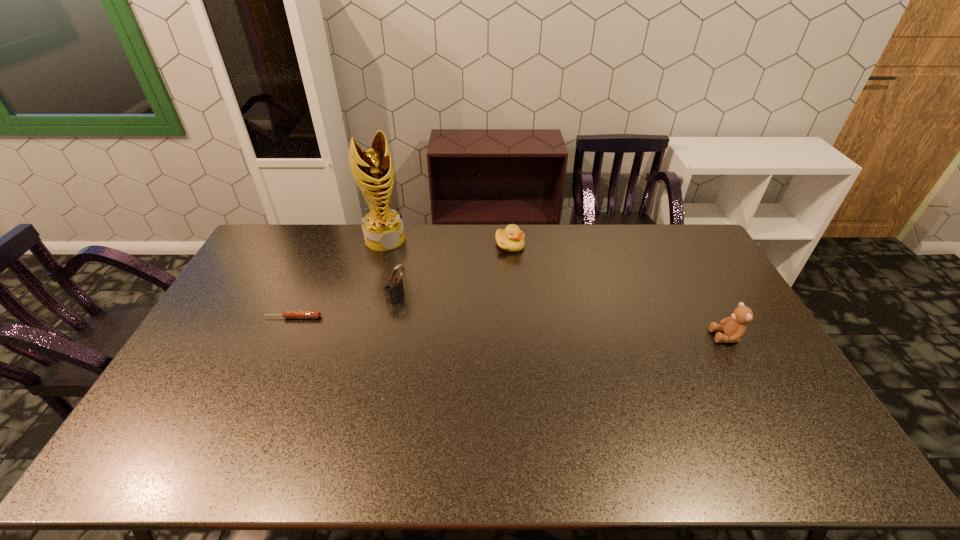
Image resolution: width=960 pixels, height=540 pixels. What are the coordinates of `free space on the desktop that is between the second nearest object and the nearest object and is positioned with the keyhole on the front of the third farthest object` in the screenshot? It's located at (448, 324).

At what (x,y) coordinates should I click in order to perform the action: click on free space on the desktop that is between the shortest object and the nearest object and is positioned on the beak of the fourth object from left to right. Please return your answer as a coordinate pair (x, y). Image resolution: width=960 pixels, height=540 pixels. Looking at the image, I should click on (560, 329).

You are a GUI agent. You are given a task and a screenshot of the screen. Output one action in this format:
    pyautogui.click(x=<x>, y=<y>)
    Task: Click on the vacant space on the desktop that is between the fourth farthest object and the nearest object and is positioned on the front-facing side of the tallest object
    The width and height of the screenshot is (960, 540).
    Given the screenshot: What is the action you would take?
    pyautogui.click(x=443, y=324)